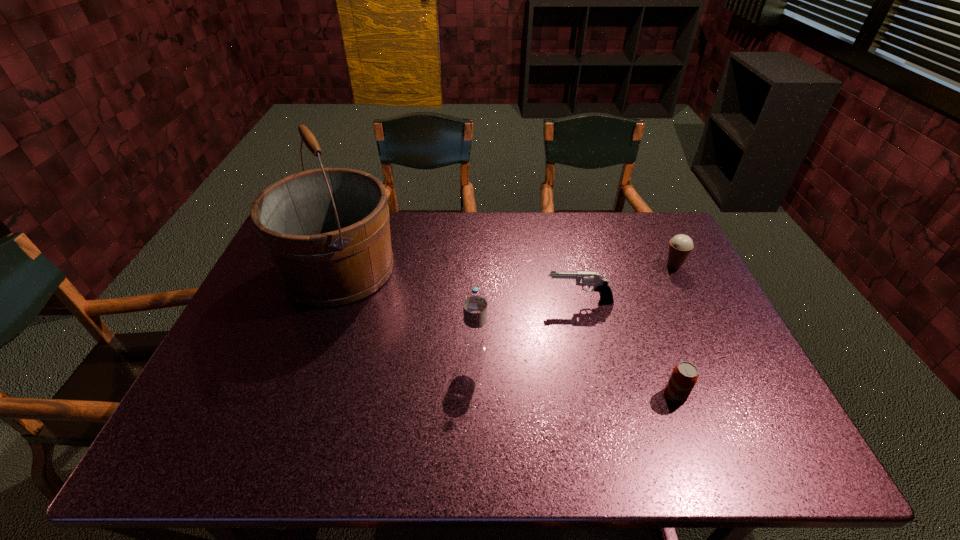
The width and height of the screenshot is (960, 540). Find the location of `unoccupied position between the rightmost object and the bucket`. unoccupied position between the rightmost object and the bucket is located at coordinates (506, 267).

This screenshot has width=960, height=540. Identify the location of empty location between the second object from left to right and the fourth object from left to right. (575, 373).

This screenshot has height=540, width=960. What are the coordinates of `vacant space that is in between the rightmost object and the second nearest object` in the screenshot? It's located at pyautogui.click(x=575, y=308).

Locate an element on the screen. The image size is (960, 540). free point between the second object from left to right and the third object from left to right is located at coordinates (528, 326).

I want to click on free space between the second object from right to left and the bucket, so click(507, 332).

The image size is (960, 540). In order to click on object that ranks as the fourth closest to the fourth object from left to right in this screenshot , I will do `click(326, 231)`.

Where is `object that can be found as the second closest to the third object from left to right`? The height and width of the screenshot is (540, 960). object that can be found as the second closest to the third object from left to right is located at coordinates (680, 246).

At what (x,y) coordinates should I click in order to perform the action: click on vacant space that satisfies the following two spatial constraints: 1. on the back side of the icecream; 2. on the left side of the tallest object. Please return your answer as a coordinate pair (x, y). Looking at the image, I should click on (341, 266).

Find the location of a particular element. The height and width of the screenshot is (540, 960). vacant point that satisfies the following two spatial constraints: 1. at the muzzle of the third object from right to left; 2. on the right side of the beer can is located at coordinates (602, 395).